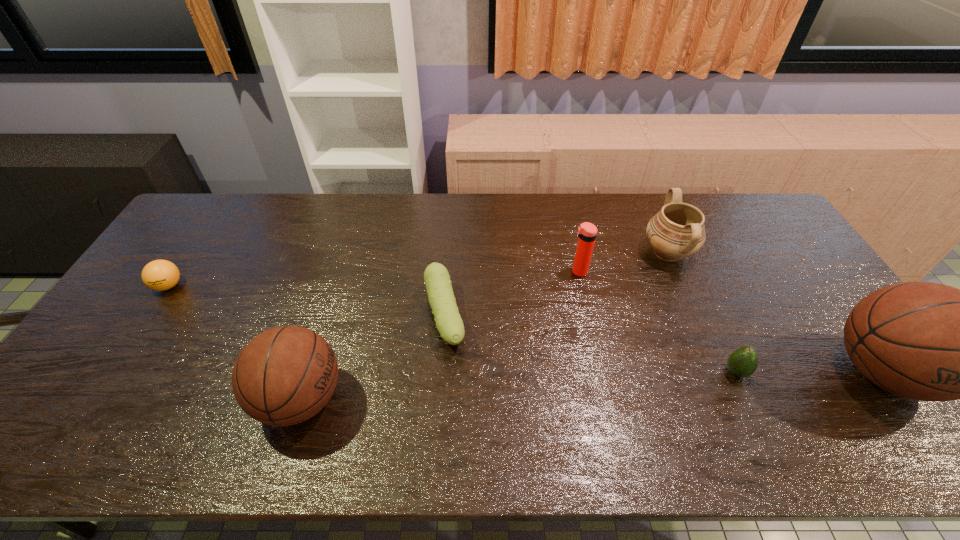
To achieve even spacing by inserting another basketball among them, please point to a vacant spot for this new basketball. Please provide its 2D coordinates. Your answer should be formatted as a tuple, i.e. [(x, y)], where the tuple contains the x and y coordinates of a point satisfying the conditions above.

[(598, 386)]